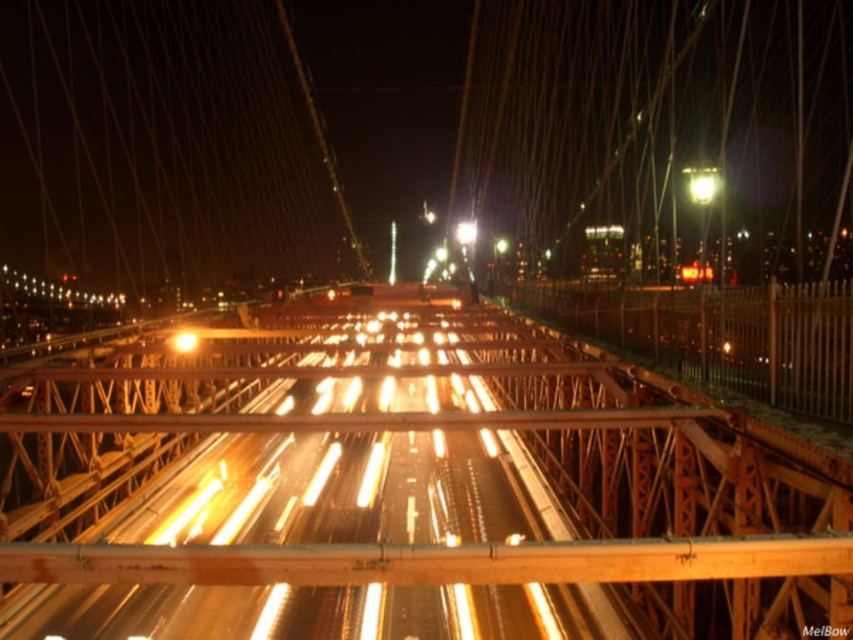
You are standing on the Brooklyn Bridge pedestrian walkway at night. You notice two lights below you on the roadway. One is the yellow metallic light at center and the other is the bright metallic streetlight at center. From your vantage point, which light is positioned to the left?

The yellow metallic light at center is positioned to the left of the bright metallic streetlight at center.

You are standing on the Brooklyn Bridge at night and notice two lights ahead. One is the yellow metallic light at center and the other is the bright metallic streetlight at center. Which of these two lights is shorter in height?

The yellow metallic light at center is shorter in height compared to the bright metallic streetlight at center.

You are a photographer standing on the Brooklyn Bridge at night. You notice two lights in the center of the image, the yellow metallic light at center and the bright metallic streetlight at center. Which one appears smaller in the photo?

The yellow metallic light at center appears smaller than the bright metallic streetlight at center in the photo.